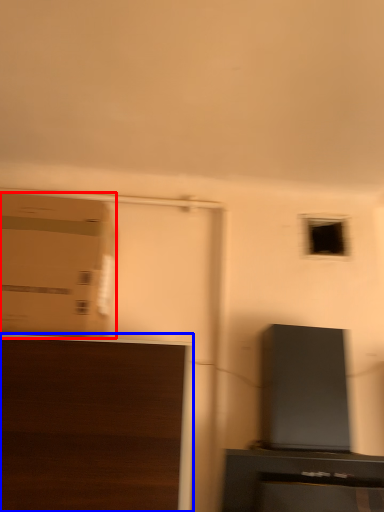
Question: Which object appears closest to the camera in this image, cardboard box (highlighted by a red box) or furniture (highlighted by a blue box)?

Choices:
 (A) cardboard box
 (B) furniture

Answer: (B)